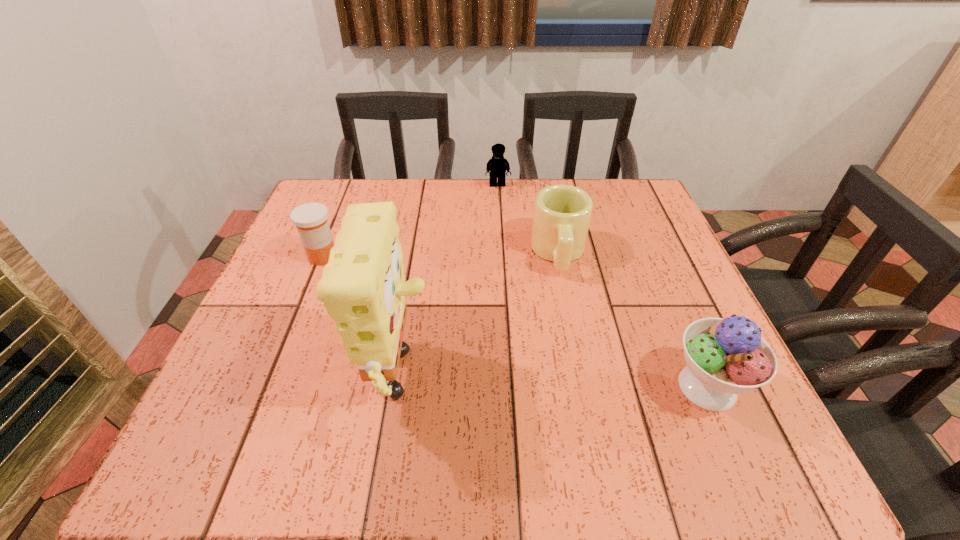
Find the location of a particular element. This screenshot has height=540, width=960. free location located on the front-facing side of the third object from left to right is located at coordinates [x=503, y=226].

Identify the location of vacant area situated 0.290m on the front-facing side of the third object from left to right. The width and height of the screenshot is (960, 540). (508, 257).

You are a GUI agent. You are given a task and a screenshot of the screen. Output one action in this format:
    pyautogui.click(x=<x>, y=<y>)
    Task: Click on the free spot located on the front-facing side of the third object from left to right
    
    Given the screenshot: What is the action you would take?
    pyautogui.click(x=506, y=246)

Where is `vacant space situated on the label of the leftmost object`? vacant space situated on the label of the leftmost object is located at coordinates (452, 320).

Identify the location of free space located on the label of the leftmost object. This screenshot has height=540, width=960. (377, 283).

Locate an element on the screen. The width and height of the screenshot is (960, 540). vacant area located on the label of the leftmost object is located at coordinates (353, 272).

Image resolution: width=960 pixels, height=540 pixels. I want to click on vacant area situated with the handle on the side of the mug, so 564,300.

Locate an element on the screen. The image size is (960, 540). free location located with the handle on the side of the mug is located at coordinates (565, 307).

The height and width of the screenshot is (540, 960). I want to click on vacant space located 0.320m with the handle on the side of the mug, so click(576, 411).

Image resolution: width=960 pixels, height=540 pixels. What are the coordinates of `Lego located in the far edge section of the desktop` in the screenshot? It's located at (497, 165).